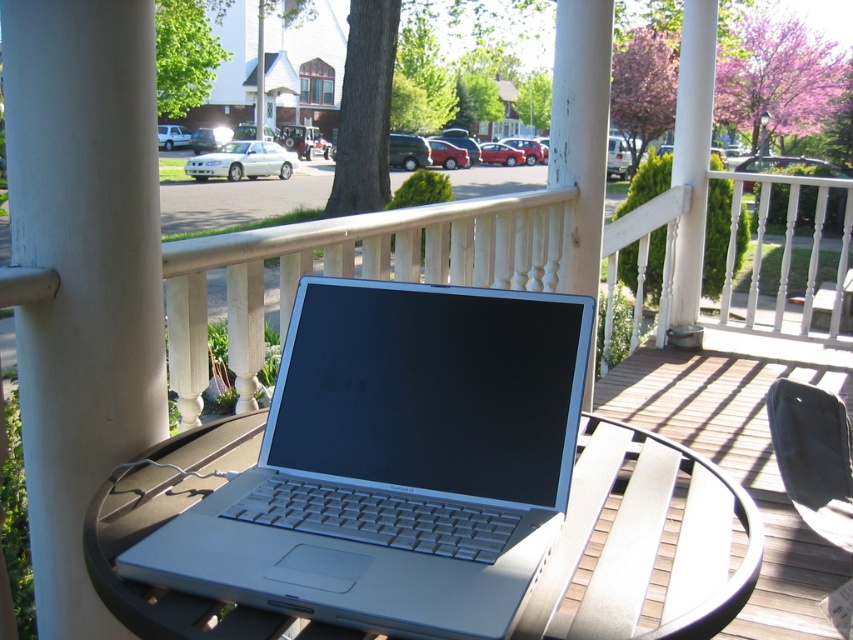
Can you confirm if silver metallic laptop at center is positioned above white painted wood at center?

No.

Which is in front, point (260, 564) or point (91, 198)?

Point (260, 564) is more forward.

Between point (260, 600) and point (80, 620), which one is positioned behind?

Positioned behind is point (80, 620).

The image size is (853, 640). I want to click on silver metallic laptop at center, so click(396, 464).

In the scene shown: Between silver metallic laptop at center and brown wooden deck at center, which one appears on the left side from the viewer's perspective?

Positioned to the left is silver metallic laptop at center.

Is point (444, 465) farther from viewer compared to point (665, 426)?

No, (444, 465) is in front of (665, 426).

You are a GUI agent. You are given a task and a screenshot of the screen. Output one action in this format:
    pyautogui.click(x=<x>, y=<y>)
    Task: Click on the silver metallic laptop at center
    Image resolution: width=853 pixels, height=640 pixels.
    Given the screenshot: What is the action you would take?
    pyautogui.click(x=396, y=464)

Can you confirm if white painted wood at center is positioned below brown wooden deck at center?

Actually, white painted wood at center is above brown wooden deck at center.

Is point (138, 317) positioned in front of point (798, 636)?

That is True.

Locate an element on the screen. The image size is (853, 640). white painted wood at center is located at coordinates point(82,275).